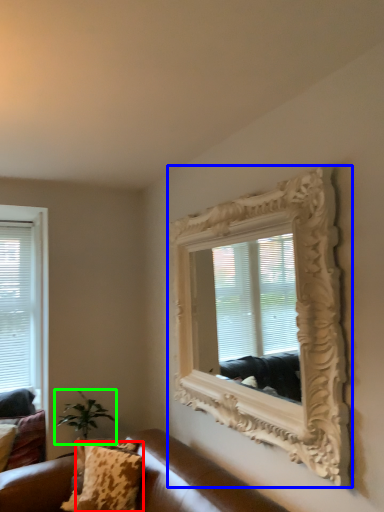
Question: Based on their relative distances, which object is nearer to pillow (highlighted by a red box)? Choose from picture frame (highlighted by a blue box) and houseplant (highlighted by a green box).

Choices:
 (A) picture frame
 (B) houseplant

Answer: (B)